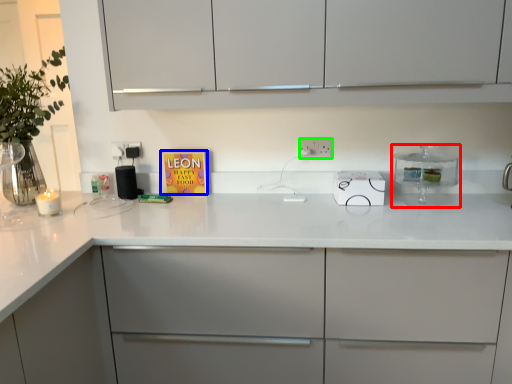
Question: Considering the real-world distances, which object is farthest from kitchen appliance (highlighted by a red box)? book cover (highlighted by a blue box) or electric outlet (highlighted by a green box)?

Choices:
 (A) book cover
 (B) electric outlet

Answer: (A)